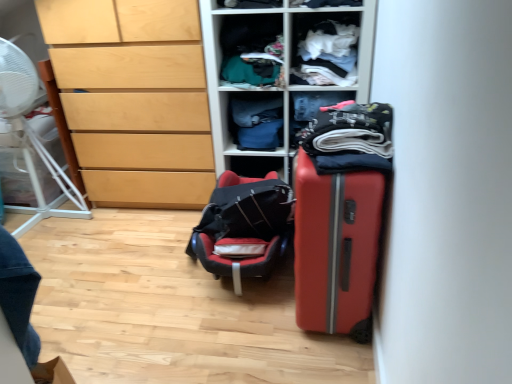
Question: Does denim fabric pants at center, positioned as the first clothing in back-to-front order, come in front of white cotton shirt at upper center, which ranks as the 4th clothing in back-to-front order?

Choices:
 (A) no
 (B) yes

Answer: (A)

Question: Does denim fabric pants at center, the fifth clothing positioned from the front, have a lesser width compared to white cotton shirt at upper center, which is counted as the second clothing, starting from the front?

Choices:
 (A) yes
 (B) no

Answer: (A)

Question: From the image's perspective, is denim fabric pants at center, the fifth clothing positioned from the front, beneath white cotton shirt at upper center, which is counted as the second clothing, starting from the front?

Choices:
 (A) yes
 (B) no

Answer: (A)

Question: Is denim fabric pants at center, positioned as the first clothing in back-to-front order, bigger than white cotton shirt at upper center, which ranks as the 4th clothing in back-to-front order?

Choices:
 (A) yes
 (B) no

Answer: (B)

Question: Is white cotton shirt at upper center, which ranks as the 4th clothing in back-to-front order, at the back of denim fabric pants at center, positioned as the first clothing in back-to-front order?

Choices:
 (A) yes
 (B) no

Answer: (B)

Question: Is denim fabric pants at center, the fifth clothing positioned from the front, shorter than white cotton shirt at upper center, which ranks as the 4th clothing in back-to-front order?

Choices:
 (A) no
 (B) yes

Answer: (B)

Question: Is black fabric backpack at center further to camera compared to dark blue fabric at center, which appears as the fourth clothing when viewed from the front?

Choices:
 (A) no
 (B) yes

Answer: (A)

Question: Is black fabric backpack at center not inside dark blue fabric at center, which appears as the fourth clothing when viewed from the front?

Choices:
 (A) yes
 (B) no

Answer: (A)

Question: From the image's perspective, is black fabric backpack at center under dark blue fabric at center, which appears as the fourth clothing when viewed from the front?

Choices:
 (A) yes
 (B) no

Answer: (A)

Question: Could dark blue fabric at center, which appears as the fourth clothing when viewed from the front, be considered to be inside black fabric backpack at center?

Choices:
 (A) yes
 (B) no

Answer: (B)

Question: Can you confirm if black fabric backpack at center is taller than dark blue fabric at center, which ranks as the 2th clothing in back-to-front order?

Choices:
 (A) no
 (B) yes

Answer: (A)

Question: Is black fabric backpack at center turned away from dark blue fabric at center, which appears as the fourth clothing when viewed from the front?

Choices:
 (A) yes
 (B) no

Answer: (B)

Question: Is the surface of denim fabric pants at center, the fifth clothing positioned from the front, in direct contact with dark blue fabric at center, which appears as the fourth clothing when viewed from the front?

Choices:
 (A) no
 (B) yes

Answer: (A)